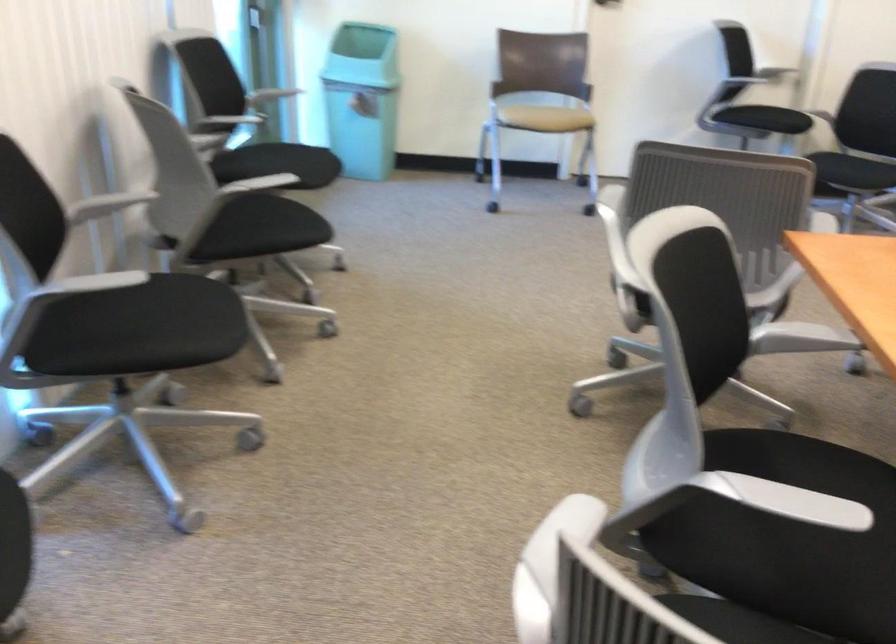
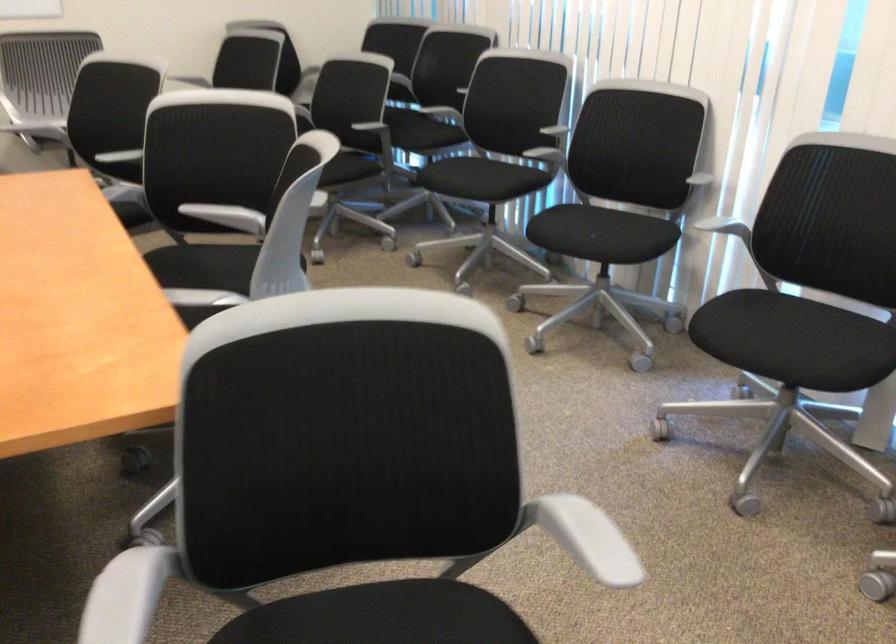
Where in the second image is the point corresponding to pixel 745 486 from the first image?

(208, 212)